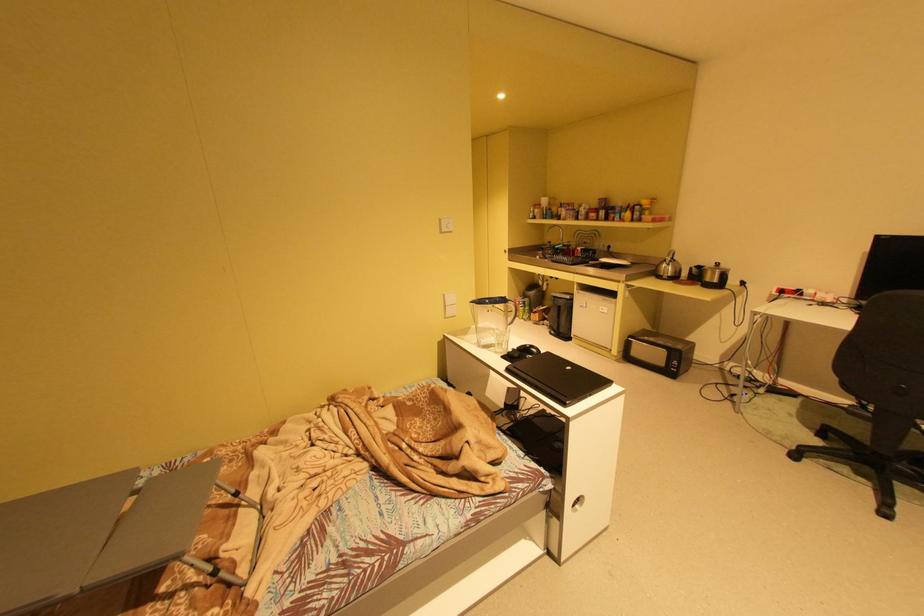
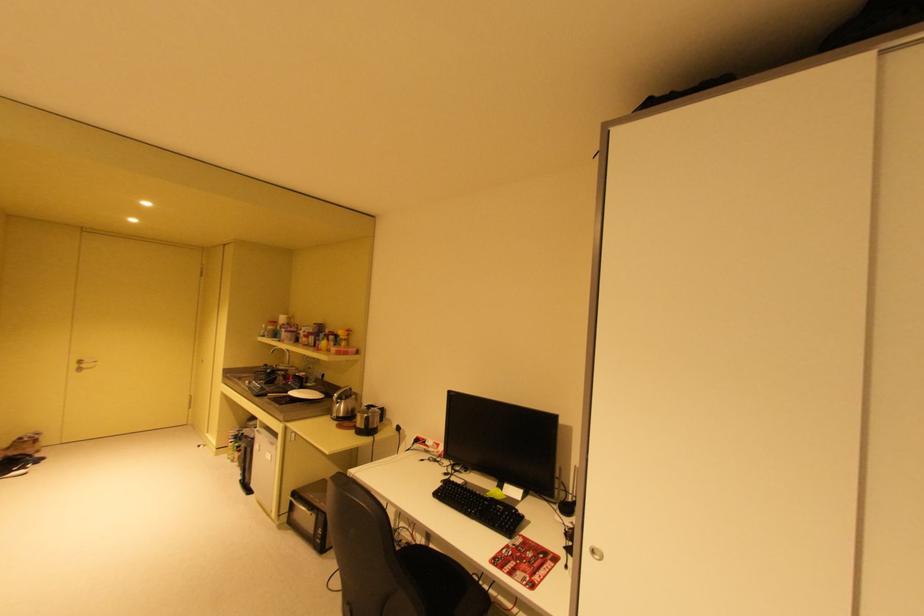
Question: In a continuous first-person perspective shot, in which direction is the camera moving?

Choices:
 (A) Left
 (B) Right
 (C) Forward
 (D) Backward

Answer: (B)